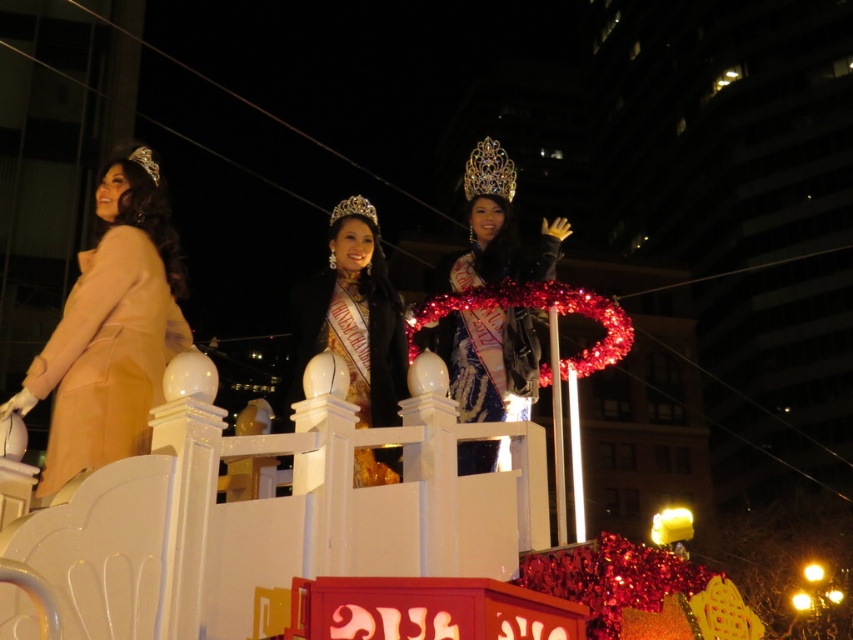
Between point (88, 465) and point (325, 275), which one is positioned behind?

Positioned behind is point (325, 275).

Does point (57, 381) come farther from viewer compared to point (300, 292)?

No, it is not.

Who is more forward, (x=119, y=227) or (x=402, y=378)?

Point (x=119, y=227)

Identify the location of beige satin coat at left. (111, 328).

Between shiny blue dress at center and gold satin sash at center, which one is positioned lower?

gold satin sash at center

Can you confirm if shiny blue dress at center is positioned above gold satin sash at center?

Yes.

Between point (466, 196) and point (294, 324), which one is positioned in front?

Positioned in front is point (294, 324).

Locate an element on the screen. The height and width of the screenshot is (640, 853). shiny blue dress at center is located at coordinates (483, 358).

From the picture: Who is positioned more to the left, beige satin coat at left or shiny blue dress at center?

From the viewer's perspective, beige satin coat at left appears more on the left side.

Is beige satin coat at left positioned in front of shiny blue dress at center?

Yes.

Who is more forward, (144, 177) or (564, 227)?

Positioned in front is point (144, 177).

You are a GUI agent. You are given a task and a screenshot of the screen. Output one action in this format:
    pyautogui.click(x=<x>, y=<y>)
    Task: Click on the beige satin coat at left
    Image resolution: width=853 pixels, height=640 pixels.
    Given the screenshot: What is the action you would take?
    pyautogui.click(x=111, y=328)